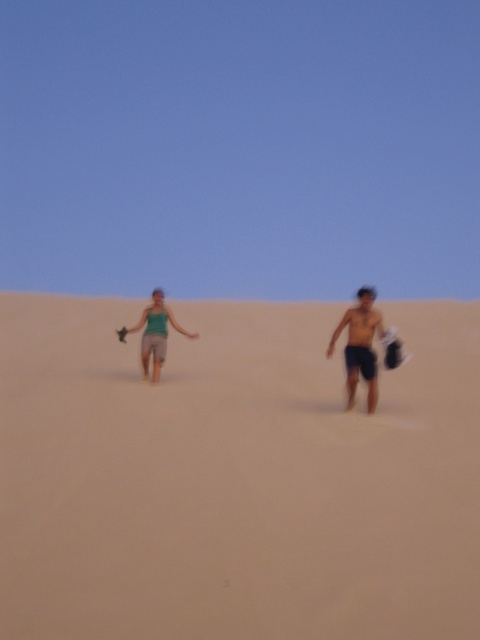
Does beige sandy beach at center have a greater width compared to matte green tank top at center?

Indeed, beige sandy beach at center has a greater width compared to matte green tank top at center.

Image resolution: width=480 pixels, height=640 pixels. I want to click on beige sandy beach at center, so click(236, 476).

Locate an element on the screen. This screenshot has width=480, height=640. beige sandy beach at center is located at coordinates (236, 476).

Locate an element on the screen. The height and width of the screenshot is (640, 480). beige sandy beach at center is located at coordinates (236, 476).

Is beige sandy beach at center further to camera compared to shiny black shorts at center?

No, beige sandy beach at center is closer to the viewer.

Is point (192, 452) positioned in front of point (351, 387)?

Yes, it is.

You are a GUI agent. You are given a task and a screenshot of the screen. Output one action in this format:
    pyautogui.click(x=<x>, y=<y>)
    Task: Click on the beige sandy beach at center
    This screenshot has width=480, height=640.
    Given the screenshot: What is the action you would take?
    pyautogui.click(x=236, y=476)

Consider the image. Can you confirm if shiny black shorts at center is smaller than matte green tank top at center?

Indeed, shiny black shorts at center has a smaller size compared to matte green tank top at center.

The width and height of the screenshot is (480, 640). Describe the element at coordinates (360, 346) in the screenshot. I see `shiny black shorts at center` at that location.

Locate an element on the screen. The width and height of the screenshot is (480, 640). shiny black shorts at center is located at coordinates click(x=360, y=346).